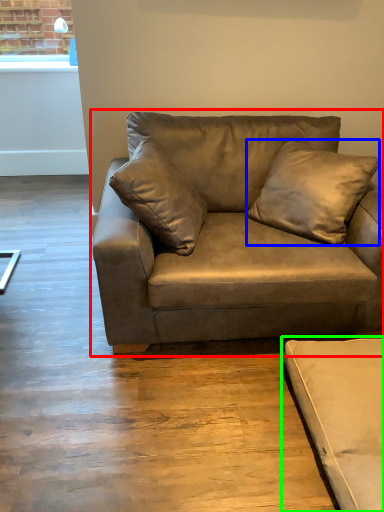
Question: Which is nearer to the studio couch (highlighted by a red box)? pillow (highlighted by a blue box) or studio couch (highlighted by a green box).

Choices:
 (A) pillow
 (B) studio couch

Answer: (A)